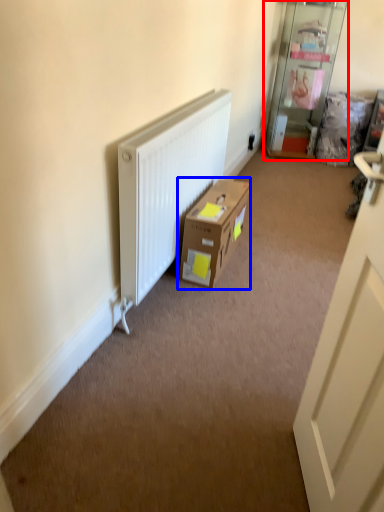
Question: Among these objects, which one is farthest to the camera, shelf (highlighted by a red box) or box (highlighted by a blue box)?

Choices:
 (A) shelf
 (B) box

Answer: (A)